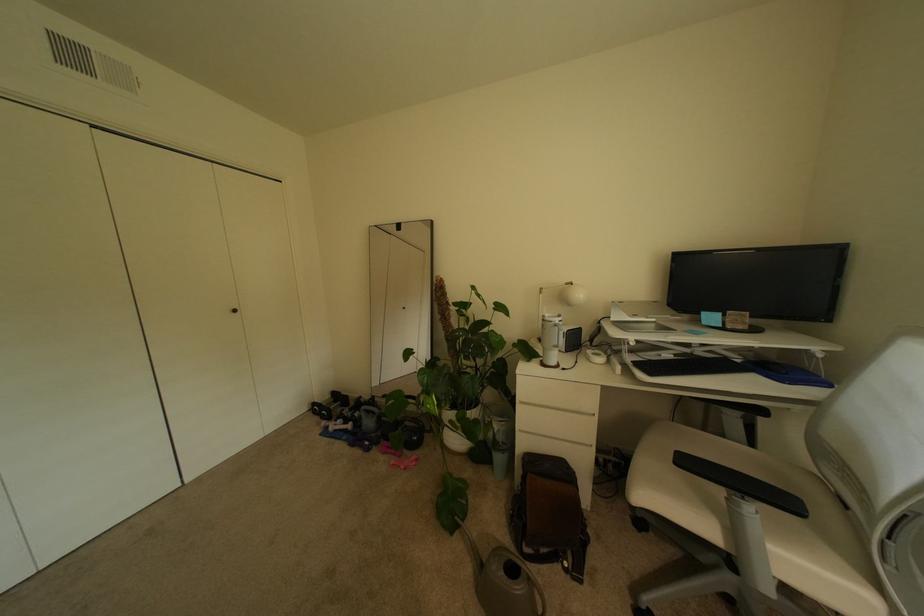
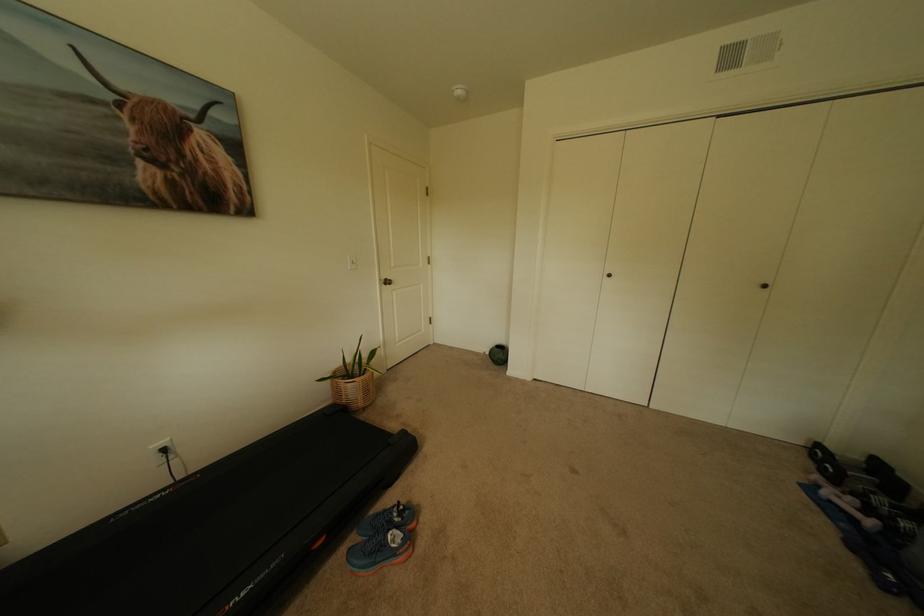
Locate, in the second image, the point that corresponds to point 354,431 in the first image.

(862, 521)